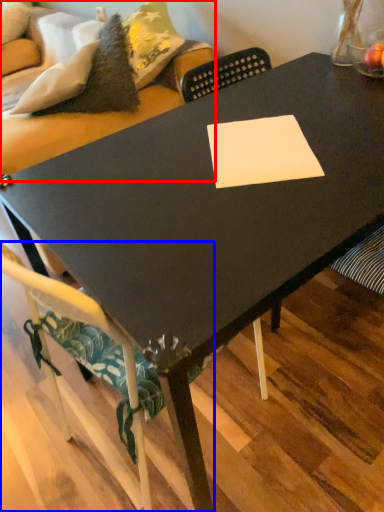
Question: Among these objects, which one is farthest to the camera, couch (highlighted by a red box) or chair (highlighted by a blue box)?

Choices:
 (A) couch
 (B) chair

Answer: (A)